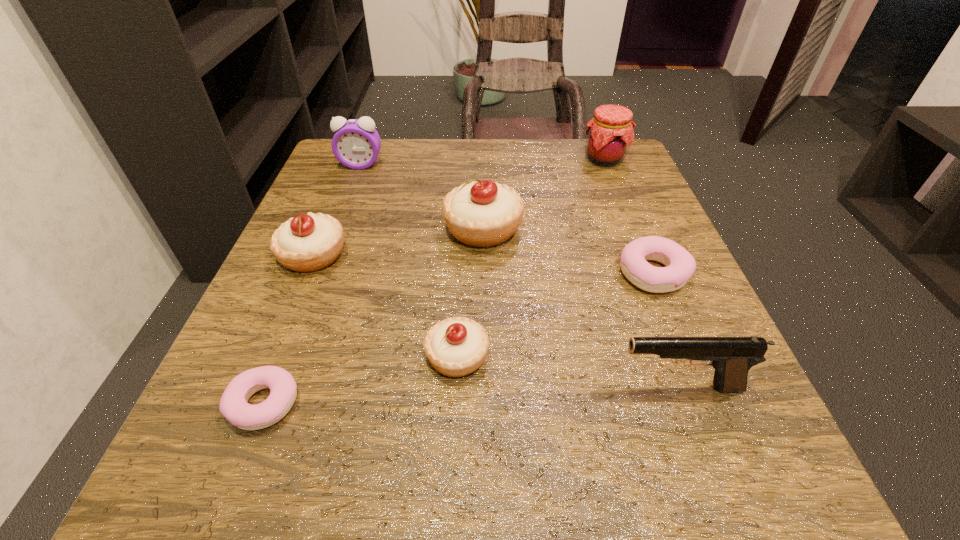
Where is `vacant position located on the front of the bigger pink pastry`? vacant position located on the front of the bigger pink pastry is located at coordinates (676, 327).

Identify the location of vacant position located 0.200m on the back of the left pink pastry. (315, 274).

At what (x,y) coordinates should I click in order to perform the action: click on jam located in the far edge section of the desktop. Please return your answer as a coordinate pair (x, y). Looking at the image, I should click on (610, 133).

The width and height of the screenshot is (960, 540). I want to click on alarm clock present at the far edge, so click(356, 144).

The image size is (960, 540). I want to click on alarm clock that is positioned at the left edge, so click(356, 144).

This screenshot has width=960, height=540. What are the coordinates of `jam that is at the right edge` in the screenshot? It's located at (610, 133).

At what (x,y) coordinates should I click in order to perform the action: click on pistol present at the right edge. Please return your answer as a coordinate pair (x, y). The width and height of the screenshot is (960, 540). Looking at the image, I should click on (732, 357).

Where is `pastry that is at the right edge`? pastry that is at the right edge is located at coordinates (680, 265).

Locate an element on the screen. The height and width of the screenshot is (540, 960). object present at the far left corner is located at coordinates (356, 144).

Find the location of a particular element. object at the far right corner is located at coordinates (610, 133).